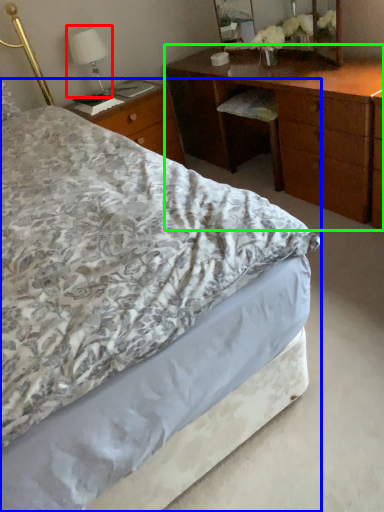
Question: Which object is the closest to the bedside lamp (highlighted by a red box)? Choose among these: bed (highlighted by a blue box) or desk (highlighted by a green box).

Choices:
 (A) bed
 (B) desk

Answer: (B)